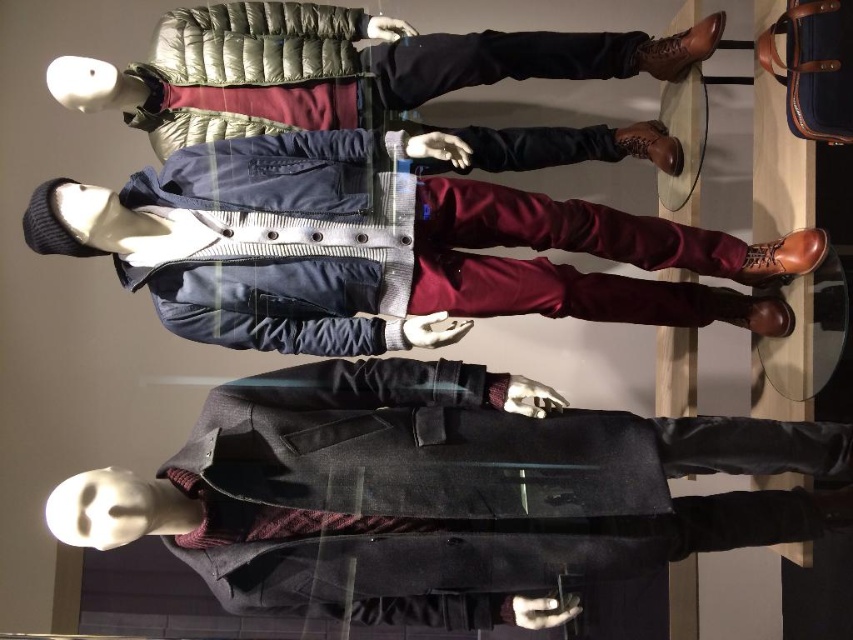
You are a fashion designer trying to decide which jacket to feature in your upcoming collection. You want to choose the wider one between the matte blue jacket at center and the matte black jacket at center. Which one should you select?

The matte blue jacket at center is wider than the matte black jacket at center, so you should select the matte blue jacket at center for your collection.

You are a tailor measuring the distance between two jackets in a store. The store has a strict rule that jackets must be at least 14 inches apart for proper display. Are the matte blue jacket at center and the matte black jacket at center spaced correctly according to the store policy?

The matte blue jacket at center is 13.71 inches from the matte black jacket at center, which is less than the required 14 inches. Therefore, they are not spaced correctly according to the store policy.

You are a customer trying to decide which jacket to buy. You see the dark gray wool coat at center and the matte black jacket at center. Which one is positioned lower on the mannequin?

The dark gray wool coat at center is positioned lower on the mannequin than the matte black jacket at center, so the dark gray wool coat at center is lower.